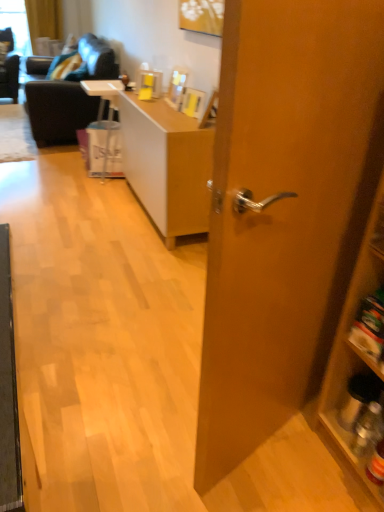
Measure the distance between light brown wood desk at center and camera.

The distance of light brown wood desk at center from camera is 2.32 meters.

Describe the element at coordinates (69, 96) in the screenshot. I see `dark gray fabric couch at upper left` at that location.

The image size is (384, 512). Identify the location of dark gray fabric couch at upper left. (69, 96).

Identify the location of white plastic bag at center. (104, 131).

Is wooden door at center smaller than dark gray fabric couch at upper left?

Correct, wooden door at center occupies less space than dark gray fabric couch at upper left.

This screenshot has height=512, width=384. Identify the location of door above the dark gray fabric couch at upper left (from a real-world perspective). (284, 210).

Considering the positions of objects wooden door at center and dark gray fabric couch at upper left in the image provided, who is behind, wooden door at center or dark gray fabric couch at upper left?

Positioned behind is dark gray fabric couch at upper left.

Could you tell me if wooden door at center is facing dark gray fabric couch at upper left?

Yes, wooden door at center is turned towards dark gray fabric couch at upper left.

In terms of size, does wooden cabinet at right appear bigger or smaller than velvet green pillow at upper left?

Clearly, wooden cabinet at right is larger in size than velvet green pillow at upper left.

Is velvet green pillow at upper left a part of wooden cabinet at right?

That's incorrect, velvet green pillow at upper left is not inside wooden cabinet at right.

Is wooden cabinet at right to the left or to the right of velvet green pillow at upper left in the image?

From the image, it's evident that wooden cabinet at right is to the right of velvet green pillow at upper left.

Considering the relative sizes of wooden cabinet at right and velvet green pillow at upper left in the image provided, is wooden cabinet at right taller than velvet green pillow at upper left?

Correct, wooden cabinet at right is much taller as velvet green pillow at upper left.

Between dark gray fabric couch at upper left and wooden cabinet at right, which one is positioned in front?

Positioned in front is wooden cabinet at right.

Can you tell me how much dark gray fabric couch at upper left and wooden cabinet at right differ in facing direction?

The facing directions of dark gray fabric couch at upper left and wooden cabinet at right are 1.16 degrees apart.

Is dark gray fabric couch at upper left thinner than wooden cabinet at right?

In fact, dark gray fabric couch at upper left might be wider than wooden cabinet at right.

In order to click on studio couch above the wooden cabinet at right (from the image's perspective) in this screenshot , I will do `click(69, 96)`.

From the image's perspective, is dark gray fabric couch at upper left positioned above or below white plastic bag at center?

Clearly, from the image's perspective, dark gray fabric couch at upper left is above white plastic bag at center.

Based on the photo, is there a large distance between dark gray fabric couch at upper left and white plastic bag at center?

They are positioned close to each other.

Where is `studio couch located on the left of white plastic bag at center`? The height and width of the screenshot is (512, 384). studio couch located on the left of white plastic bag at center is located at coordinates pos(69,96).

Do you think dark gray fabric couch at upper left is within white plastic bag at center, or outside of it?

dark gray fabric couch at upper left is not enclosed by white plastic bag at center.

Are wooden cabinet at right and light brown wood desk at center located far from each other?

Yes.

The image size is (384, 512). I want to click on desk above the wooden cabinet at right (from the image's perspective), so click(x=167, y=165).

Looking at the image, does wooden cabinet at right seem bigger or smaller compared to light brown wood desk at center?

Clearly, wooden cabinet at right is smaller in size than light brown wood desk at center.

Does wooden cabinet at right have a greater height compared to light brown wood desk at center?

Yes, wooden cabinet at right is taller than light brown wood desk at center.

From the image's perspective, is light brown wood desk at center on top of wooden cabinet at right?

Correct, light brown wood desk at center appears higher than wooden cabinet at right in the image.

Based on the photo, can you confirm if light brown wood desk at center is bigger than wooden cabinet at right?

Indeed, light brown wood desk at center has a larger size compared to wooden cabinet at right.

Does light brown wood desk at center appear on the right side of wooden cabinet at right?

In fact, light brown wood desk at center is to the left of wooden cabinet at right.

The width and height of the screenshot is (384, 512). In order to click on cabinetry above the light brown wood desk at center (from a real-world perspective) in this screenshot , I will do `click(359, 362)`.

Based on the photo, can you confirm if wooden door at center is wider than wooden cabinet at right?

In fact, wooden door at center might be narrower than wooden cabinet at right.

In terms of size, does wooden door at center appear bigger or smaller than wooden cabinet at right?

wooden door at center is bigger than wooden cabinet at right.

From the image's perspective, is wooden door at center above wooden cabinet at right?

Yes.

Where is `studio couch on the left of wooden door at center`? studio couch on the left of wooden door at center is located at coordinates (69, 96).

You are a GUI agent. You are given a task and a screenshot of the screen. Output one action in this format:
    pyautogui.click(x=<x>, y=<y>)
    Task: Click on the cabinetry located in front of the velvet green pillow at upper left
    This screenshot has width=384, height=512.
    Given the screenshot: What is the action you would take?
    pyautogui.click(x=359, y=362)

Which object lies nearer to the anchor point dark gray fabric couch at upper left, wooden cabinet at right or light brown wood desk at center?

light brown wood desk at center lies closer to dark gray fabric couch at upper left than the other object.

Looking at this image, estimate the real-world distances between objects in this image. Which object is further from wooden cabinet at right, wooden door at center or velvet green pillow at upper left?

Based on the image, velvet green pillow at upper left appears to be further to wooden cabinet at right.

When comparing their distances from dark gray fabric couch at upper left, does wooden cabinet at right or white plastic bag at center seem closer?

white plastic bag at center is positioned closer to the anchor dark gray fabric couch at upper left.

Based on their spatial positions, is light brown wood desk at center or wooden door at center closer to wooden cabinet at right?

The object closer to wooden cabinet at right is wooden door at center.

Looking at the image, which one is located closer to white plastic bag at center, light brown wood desk at center or velvet green pillow at upper left?

velvet green pillow at upper left is closer to white plastic bag at center.

Considering their positions, is wooden door at center positioned further to white plastic bag at center than wooden cabinet at right?

wooden cabinet at right is positioned further to the anchor white plastic bag at center.

Based on the photo, estimate the real-world distances between objects in this image. Which object is further from light brown wood desk at center, velvet green pillow at upper left or dark gray fabric couch at upper left?

Based on the image, velvet green pillow at upper left appears to be further to light brown wood desk at center.

When comparing their distances from wooden door at center, does wooden cabinet at right or dark gray fabric couch at upper left seem closer?

wooden cabinet at right lies closer to wooden door at center than the other object.

Image resolution: width=384 pixels, height=512 pixels. I want to click on studio couch between light brown wood desk at center and velvet green pillow at upper left along the z-axis, so click(69, 96).

In order to click on desk positioned between wooden cabinet at right and velvet green pillow at upper left from near to far in this screenshot , I will do `click(167, 165)`.

At what (x,y) coordinates should I click in order to perform the action: click on table located between light brown wood desk at center and velvet green pillow at upper left in the depth direction. Please return your answer as a coordinate pair (x, y). This screenshot has width=384, height=512. Looking at the image, I should click on (104, 131).

The height and width of the screenshot is (512, 384). Find the location of `cabinetry located between wooden door at center and velvet green pillow at upper left in the depth direction`. cabinetry located between wooden door at center and velvet green pillow at upper left in the depth direction is located at coordinates (359, 362).